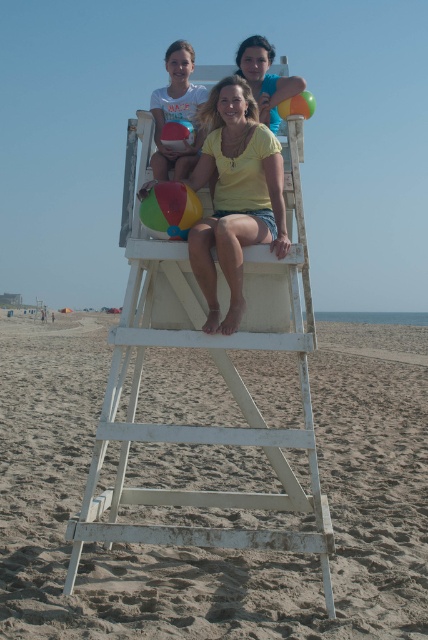
Where is `yellow matte shirt at center`? Image resolution: width=428 pixels, height=640 pixels. yellow matte shirt at center is located at coordinates (235, 196).

Is point (246, 168) positioned in front of point (264, 106)?

That is True.

Who is more forward, (241, 132) or (252, 40)?

Point (241, 132) is in front.

At what (x,y) coordinates should I click in order to perform the action: click on yellow matte shirt at center. Please return your answer as a coordinate pair (x, y). The image size is (428, 640). Looking at the image, I should click on (235, 196).

Does white wooden lifeguard chair at center appear on the left side of yellow matte shirt at center?

Correct, you'll find white wooden lifeguard chair at center to the left of yellow matte shirt at center.

Is white wooden lifeguard chair at center behind yellow matte shirt at center?

No, it is in front of yellow matte shirt at center.

Image resolution: width=428 pixels, height=640 pixels. What do you see at coordinates (208, 548) in the screenshot?
I see `white wooden lifeguard chair at center` at bounding box center [208, 548].

At what (x,y) coordinates should I click in order to perform the action: click on white wooden lifeguard chair at center. Please return your answer as a coordinate pair (x, y). The width and height of the screenshot is (428, 640). Looking at the image, I should click on (208, 548).

Who is shorter, white wooden lifeguard chair at center or matte yellow shirt at upper center?

With less height is white wooden lifeguard chair at center.

Describe the element at coordinates (208, 548) in the screenshot. I see `white wooden lifeguard chair at center` at that location.

Between point (139, 632) and point (252, 54), which one is positioned in front?

Point (139, 632) is more forward.

Locate an element on the screen. white wooden lifeguard chair at center is located at coordinates (208, 548).